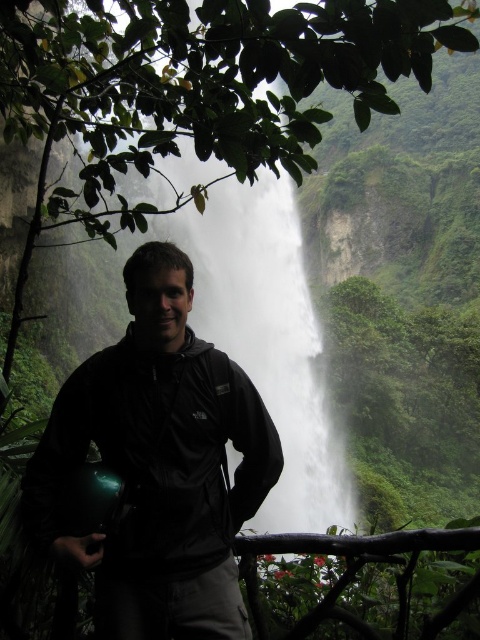
Question: Which point is closer to the camera?

Choices:
 (A) (276, 445)
 (B) (314, 454)

Answer: (A)

Question: Is the position of black matte jacket at center less distant than that of white misty waterfall at center?

Choices:
 (A) yes
 (B) no

Answer: (A)

Question: Is black matte jacket at center below brown wooden rail at lower center?

Choices:
 (A) yes
 (B) no

Answer: (B)

Question: Among these points, which one is nearest to the camera?

Choices:
 (A) (275, 211)
 (B) (82, 404)
 (C) (420, 532)

Answer: (C)

Question: Can you confirm if white misty waterfall at center is wider than brown wooden rail at lower center?

Choices:
 (A) yes
 (B) no

Answer: (A)

Question: Which object is the closest to the brown wooden rail at lower center?

Choices:
 (A) white misty waterfall at center
 (B) black matte jacket at center

Answer: (B)